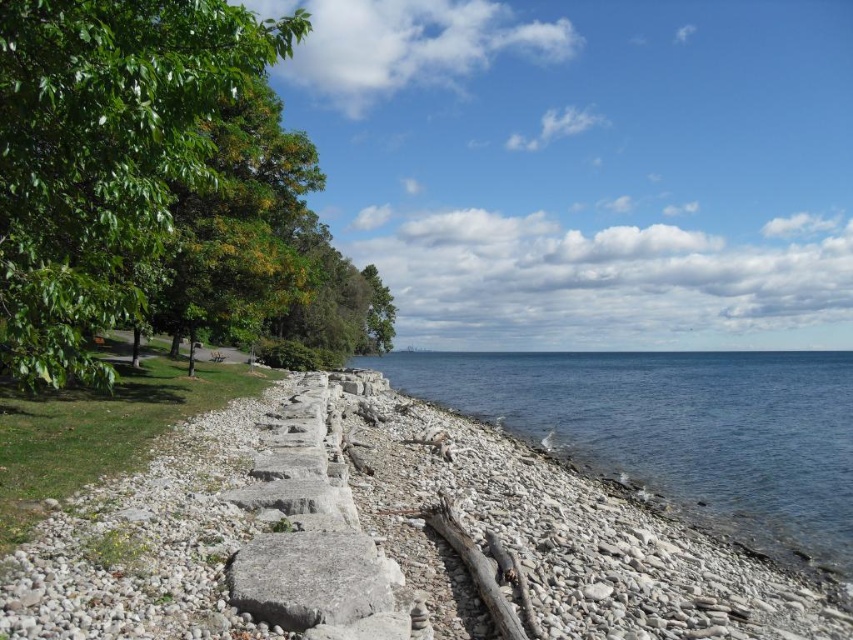
You are planning to take a photo of the green leafy tree at left and the blue water at center. Which object should you zoom in on to capture more details without moving the camera?

You should zoom in on the green leafy tree at left because it occupies less space than the blue water at center, allowing for closer detail capture without moving the camera.